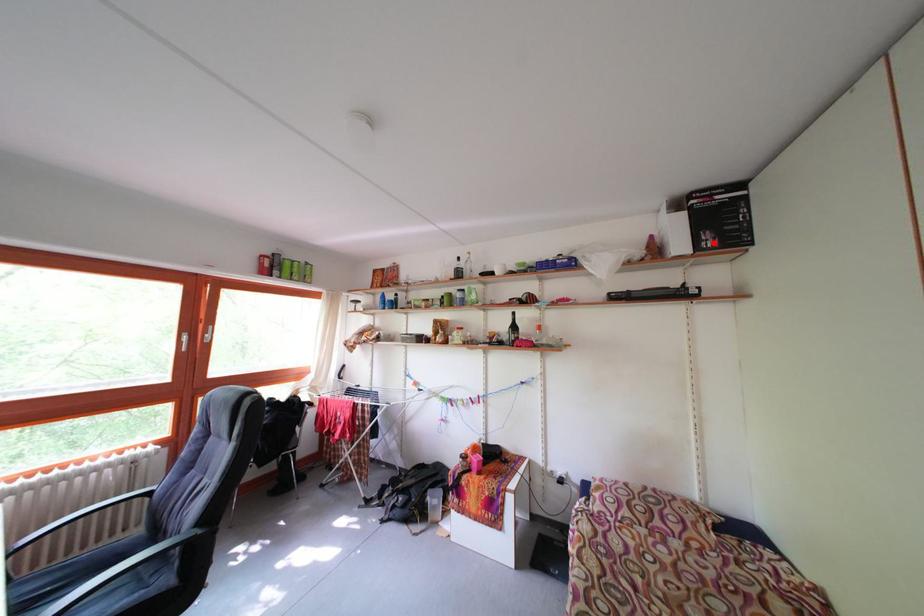
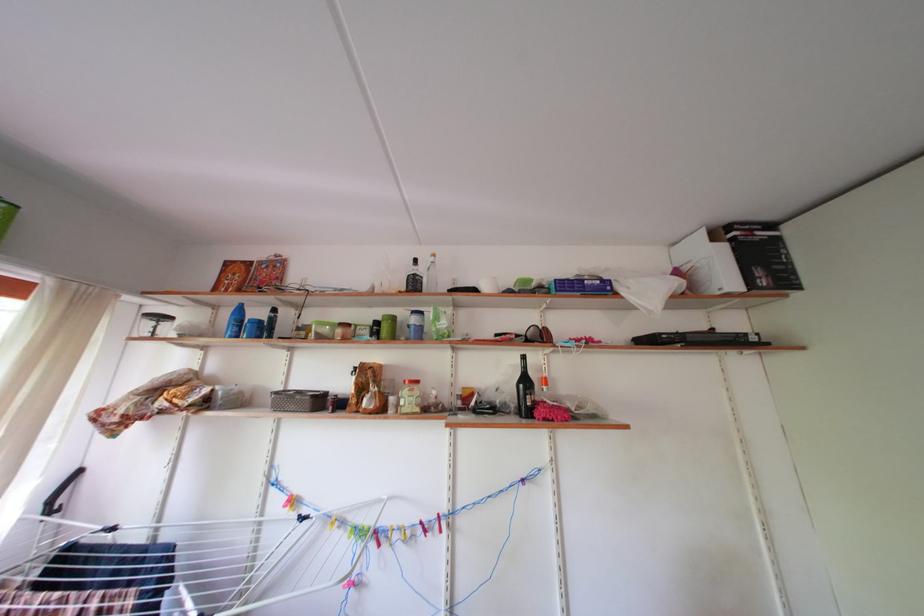
In the second image, find the point that corresponds to the highlighted location in the first image.

(768, 278)